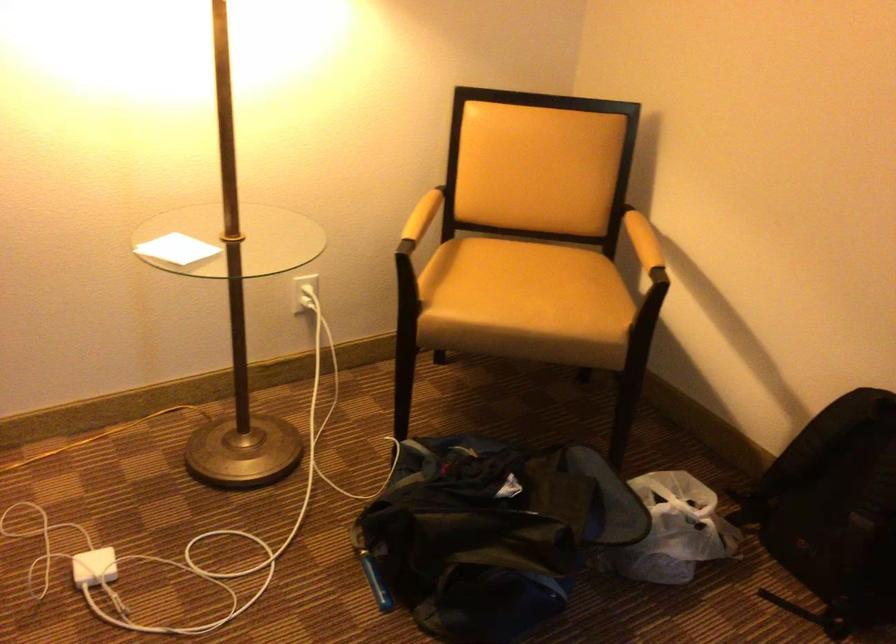
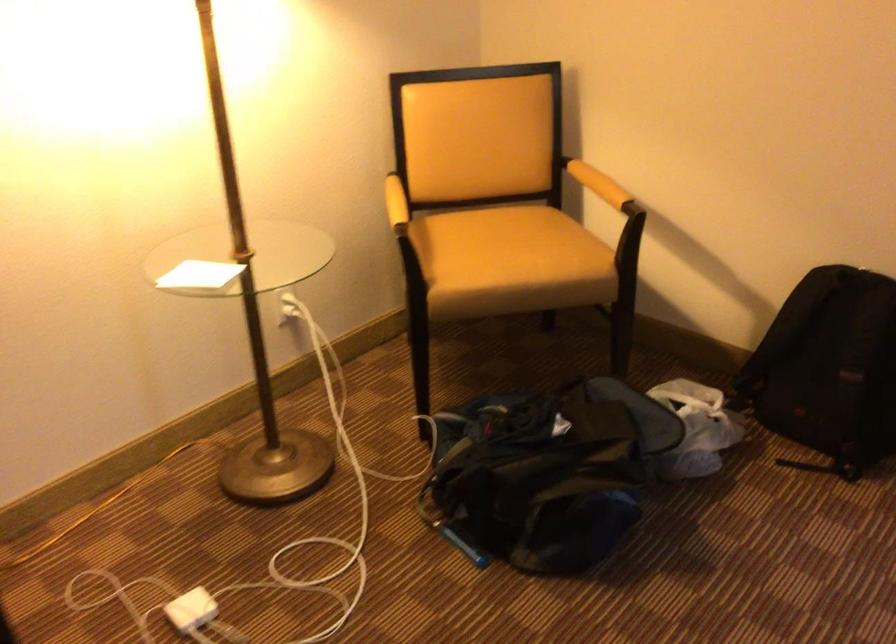
In the second image, find the point that corresponds to (x=638, y=240) in the first image.

(598, 184)